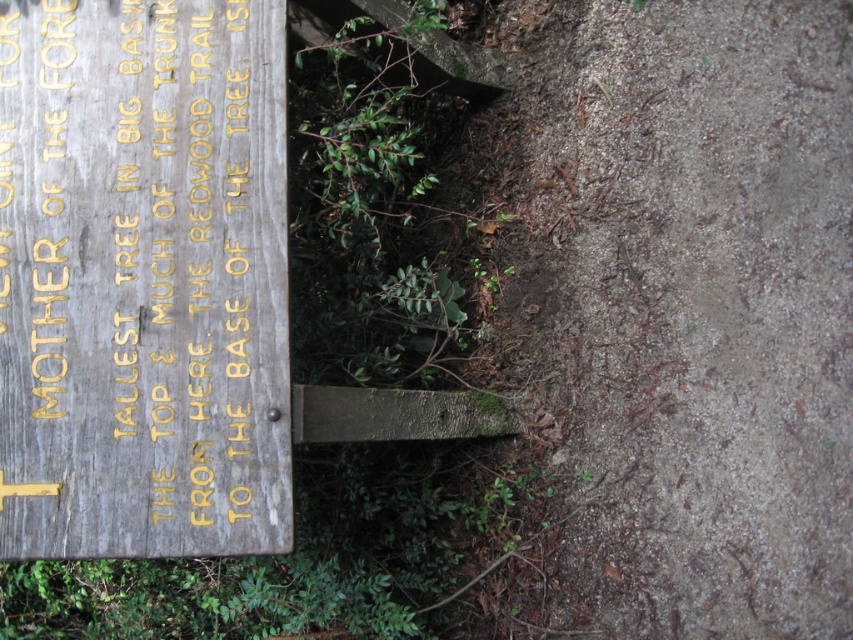
Question: Which object is farther from the camera taking this photo?

Choices:
 (A) wooden sign at center
 (B) weathered wood sign at left

Answer: (A)

Question: Observing the image, what is the correct spatial positioning of brown dirt trail at lower right in reference to weathered wood sign at left?

Choices:
 (A) below
 (B) above

Answer: (B)

Question: Where is brown dirt trail at lower right located in relation to wooden sign at center in the image?

Choices:
 (A) below
 (B) above

Answer: (B)

Question: In this image, where is brown dirt trail at lower right located relative to wooden sign at center?

Choices:
 (A) left
 (B) right

Answer: (B)

Question: Which point is closer to the camera?

Choices:
 (A) (372, 115)
 (B) (196, 65)

Answer: (B)

Question: Considering the real-world distances, which object is closest to the wooden sign at center?

Choices:
 (A) weathered wood sign at left
 (B) brown dirt trail at lower right

Answer: (A)